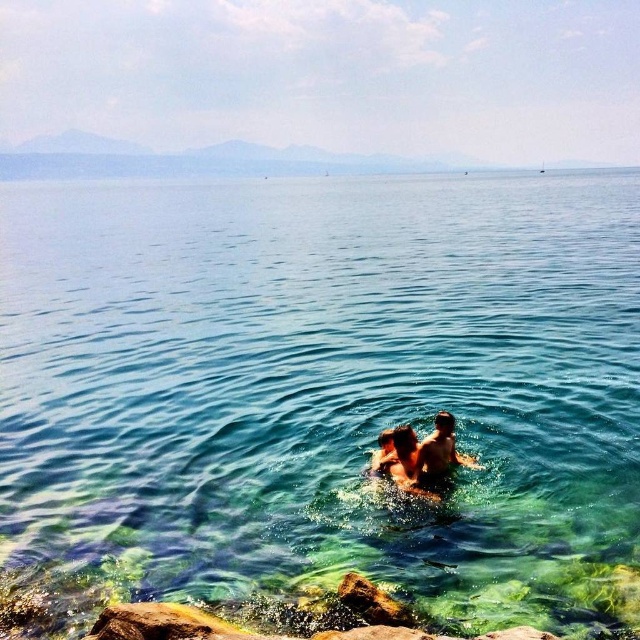
Question: Can you confirm if clear water at center is thinner than smooth skin couple at center?

Choices:
 (A) no
 (B) yes

Answer: (A)

Question: Among these points, which one is farthest from the camera?

Choices:
 (A) (390, 435)
 (B) (573, 506)
 (C) (435, 424)

Answer: (C)

Question: Considering the relative positions of smooth skin couple at center and smooth skin man at center in the image provided, where is smooth skin couple at center located with respect to smooth skin man at center?

Choices:
 (A) below
 (B) above

Answer: (A)

Question: Among these points, which one is farthest from the camera?

Choices:
 (A) (401, 445)
 (B) (566, 225)

Answer: (B)

Question: Estimate the real-world distances between objects in this image. Which object is closer to the smooth skin man at center?

Choices:
 (A) smooth skin couple at center
 (B) clear water at center

Answer: (A)

Question: Can you confirm if clear water at center is thinner than smooth skin man at center?

Choices:
 (A) yes
 (B) no

Answer: (B)